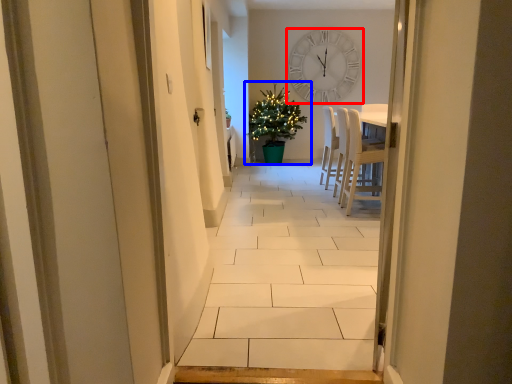
Question: Which object appears closest to the camera in this image, wall clock (highlighted by a red box) or houseplant (highlighted by a blue box)?

Choices:
 (A) wall clock
 (B) houseplant

Answer: (B)